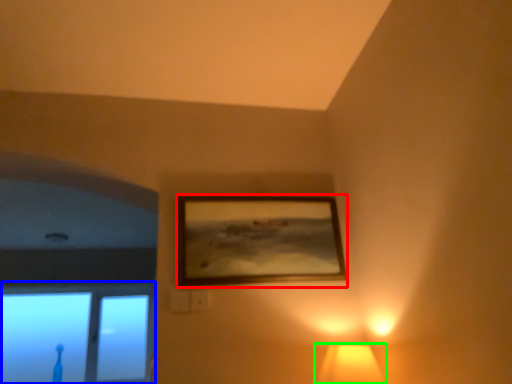
Question: Which object is the farthest from picture frame (highlighted by a red box)? Choose among these: window (highlighted by a blue box) or lamp (highlighted by a green box).

Choices:
 (A) window
 (B) lamp

Answer: (A)